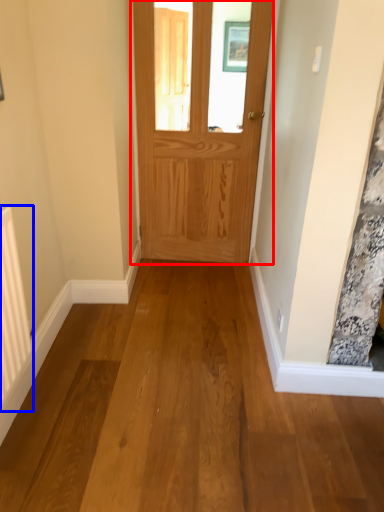
Question: Which point is further to the camera, door (highlighted by a red box) or radiator (highlighted by a blue box)?

Choices:
 (A) door
 (B) radiator

Answer: (A)